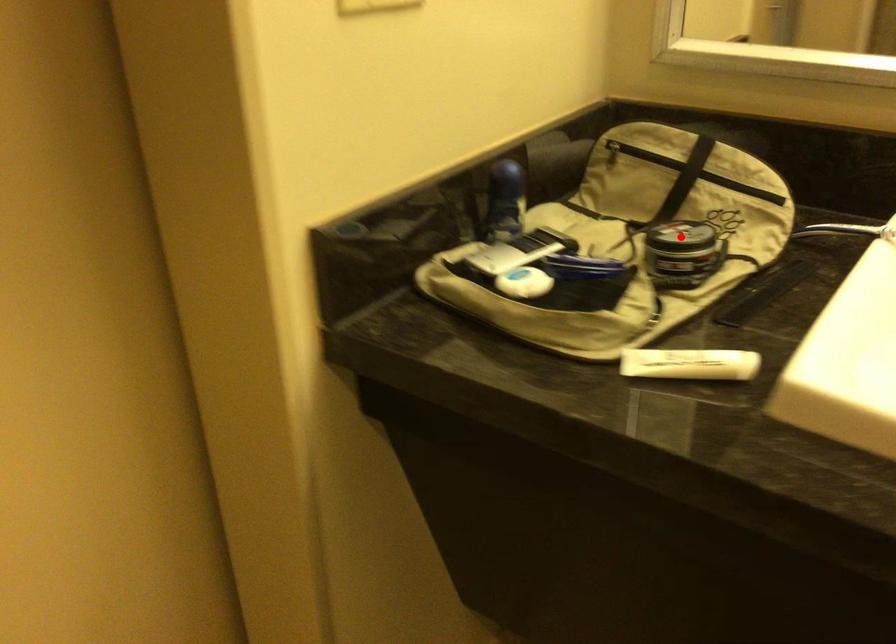
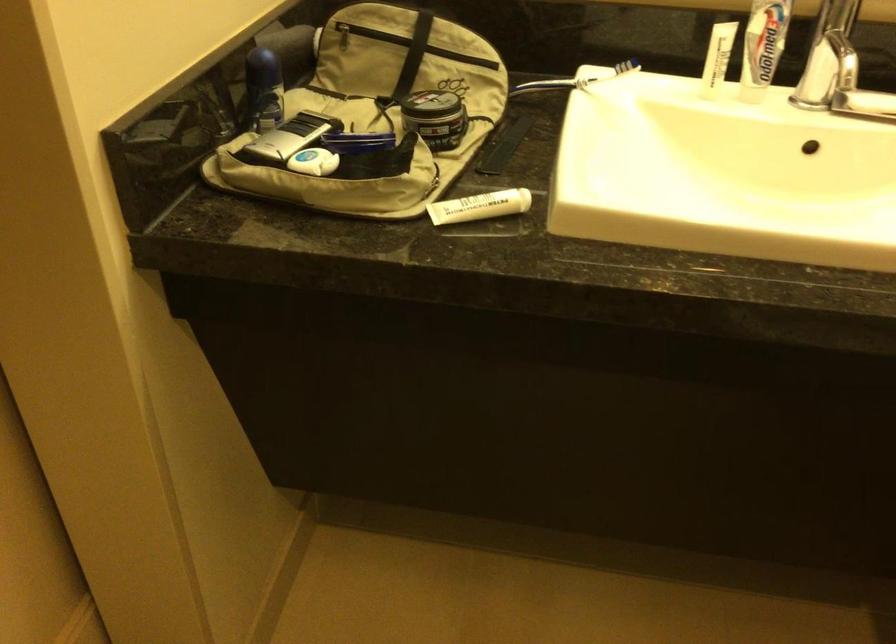
In the second image, find the point that corresponds to the highlighted location in the first image.

(433, 105)